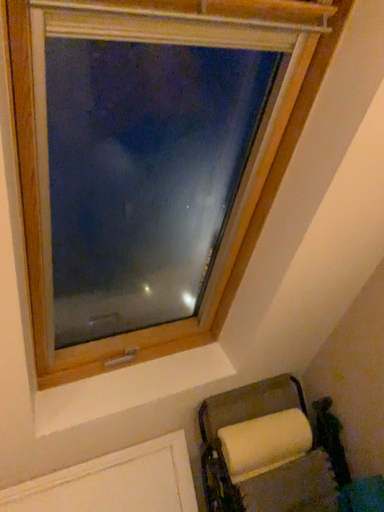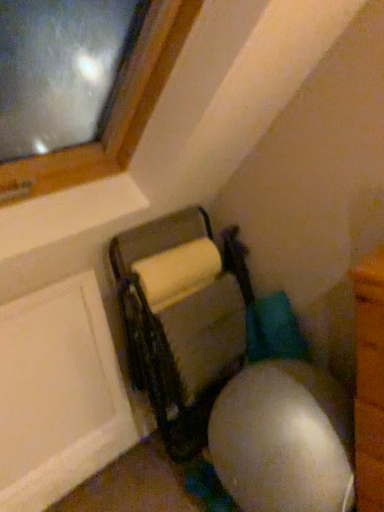
Question: How did the camera likely rotate when shooting the video?

Choices:
 (A) rotated right
 (B) rotated left

Answer: (A)